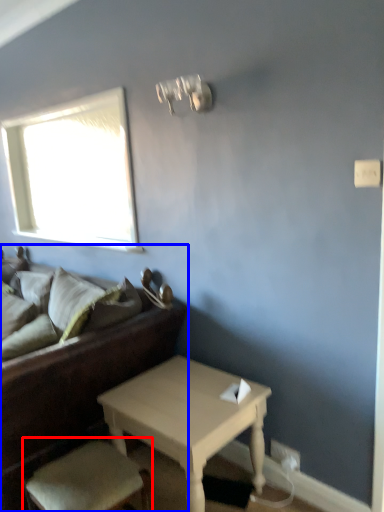
Question: Which point is closer to the camera, armchair (highlighted by a red box) or studio couch (highlighted by a blue box)?

Choices:
 (A) armchair
 (B) studio couch

Answer: (A)